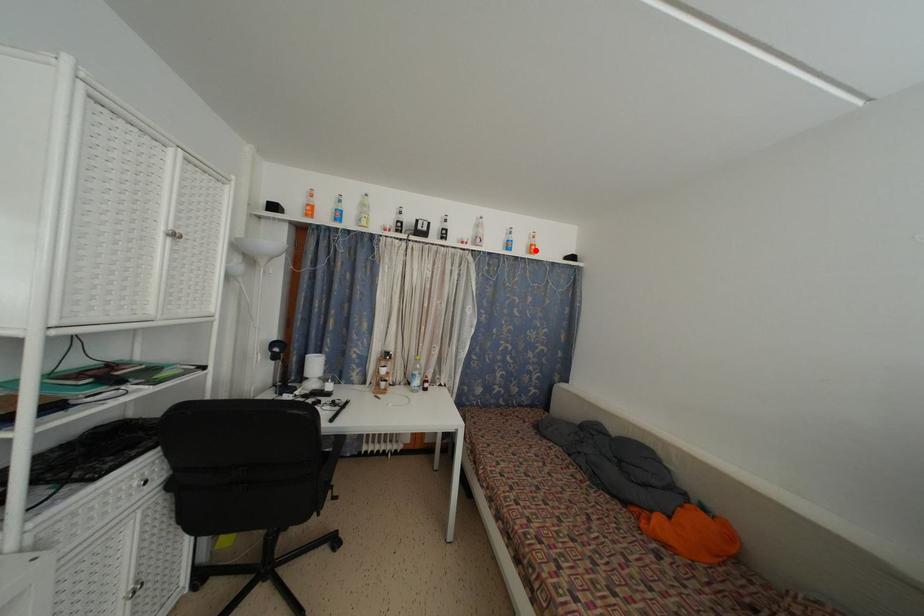
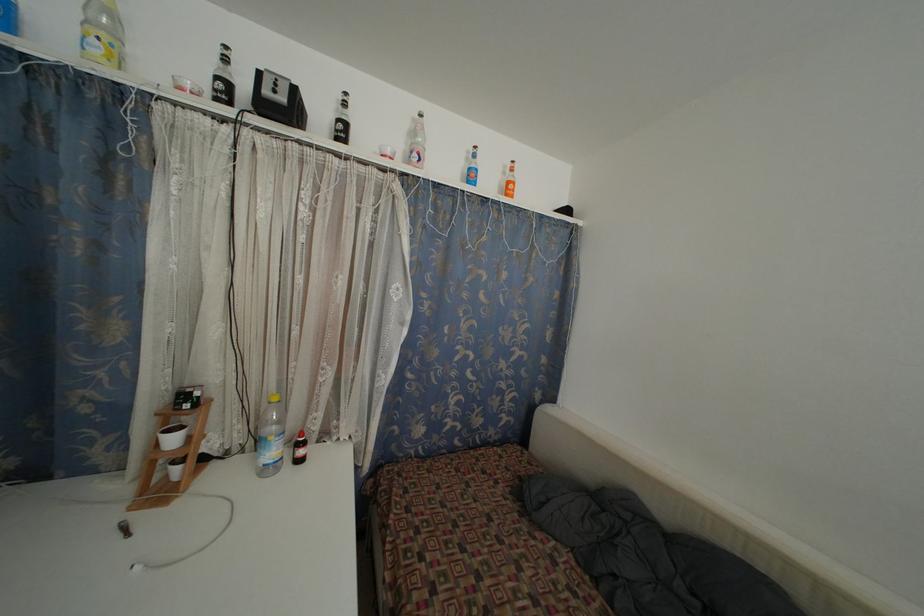
Locate, in the second image, the point that corresponds to the highlighted location in the first image.

(513, 188)